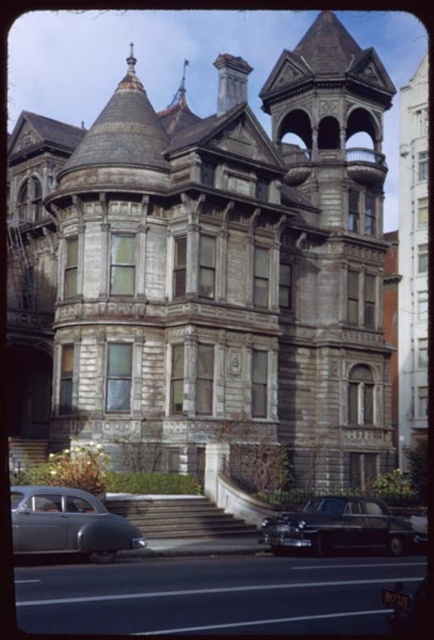
Measure the distance between stone mansion at center and silver metallic car at lower left.

34.56 meters

Is stone mansion at center to the right of silver metallic car at lower left from the viewer's perspective?

Yes, stone mansion at center is to the right of silver metallic car at lower left.

What do you see at coordinates (209, 269) in the screenshot? I see `stone mansion at center` at bounding box center [209, 269].

I want to click on stone mansion at center, so click(x=209, y=269).

Is silver metallic car at lower left smaller than shiny black sedan at lower center?

Yes.

Does point (52, 506) come in front of point (397, 516)?

Yes.

Which is in front, point (32, 538) or point (295, 515)?

Positioned in front is point (32, 538).

Identify the location of silver metallic car at lower left. (68, 524).

Is stone mansion at center wider than shiny black sedan at lower center?

Yes, stone mansion at center is wider than shiny black sedan at lower center.

Is point (196, 221) closer to camera compared to point (341, 532)?

No.

Measure the distance between point (230,92) and camera.

Point (230,92) and camera are 66.34 meters apart from each other.

Locate an element on the screen. The height and width of the screenshot is (640, 434). stone mansion at center is located at coordinates (209, 269).